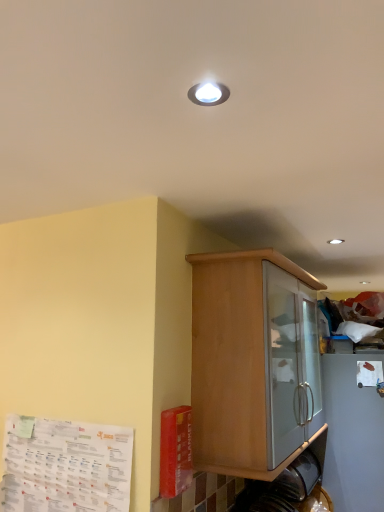
Question: Based on their positions, is white paper at lower left, marked as the 1th paper in a front-to-back arrangement, located to the left or right of white matte paper at upper right, which ranks as the second paper in front-to-back order?

Choices:
 (A) left
 (B) right

Answer: (A)

Question: From their relative heights in the image, would you say white paper at lower left, which is the second paper in right-to-left order, is taller or shorter than white matte paper at upper right, arranged as the first paper when viewed from the right?

Choices:
 (A) short
 (B) tall

Answer: (B)

Question: Which of these objects is positioned closest to the wooden cabinet at center?

Choices:
 (A) white matte paper at upper right, which ranks as the second paper in front-to-back order
 (B) white paper at lower left, arranged as the 1th paper when viewed from the left

Answer: (B)

Question: Considering the real-world distances, which object is closest to the white paper at lower left, marked as the 1th paper in a front-to-back arrangement?

Choices:
 (A) white matte paper at upper right, the 1th paper when ordered from back to front
 (B) wooden cabinet at center

Answer: (B)